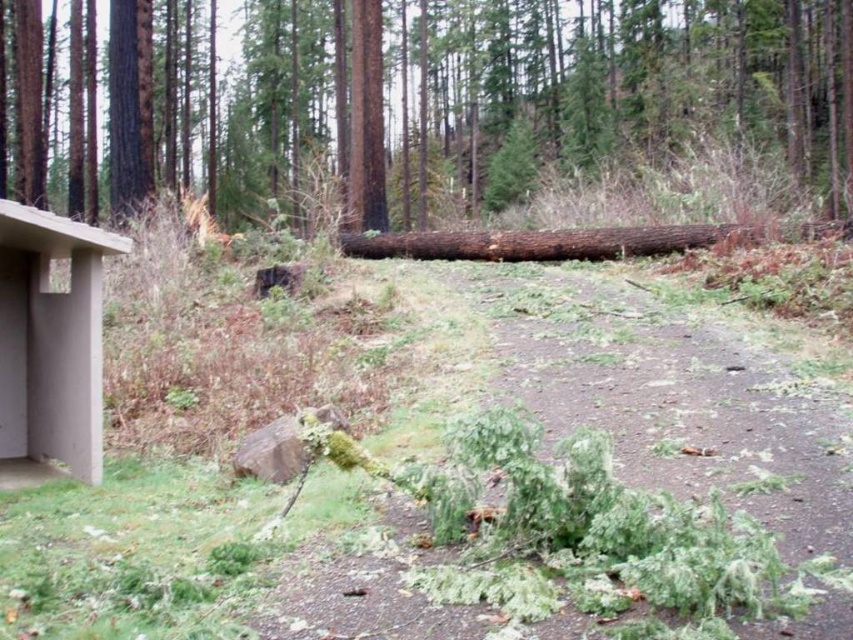
Is point (720, 352) more distant than point (74, 259)?

Yes, it is.

Between point (837, 625) and point (4, 312), which one is positioned behind?

The point (4, 312) is more distant.

Locate an element on the screen. green leafy debris at center is located at coordinates (669, 397).

Is green mossy log at center taller than green leafy debris at center?

Correct, green mossy log at center is much taller as green leafy debris at center.

How far apart are green mossy log at center and green leafy debris at center?

A distance of 13.06 meters exists between green mossy log at center and green leafy debris at center.

Who is more forward, (430, 35) or (726, 456)?

Point (726, 456)

Find the location of a particular element. This screenshot has width=853, height=640. green mossy log at center is located at coordinates (474, 99).

Can you confirm if green mossy log at center is taller than concrete at left?

Yes.

Is point (502, 36) more distant than point (84, 458)?

Yes, it is behind point (84, 458).

Image resolution: width=853 pixels, height=640 pixels. Find the location of `green mossy log at center`. green mossy log at center is located at coordinates (474, 99).